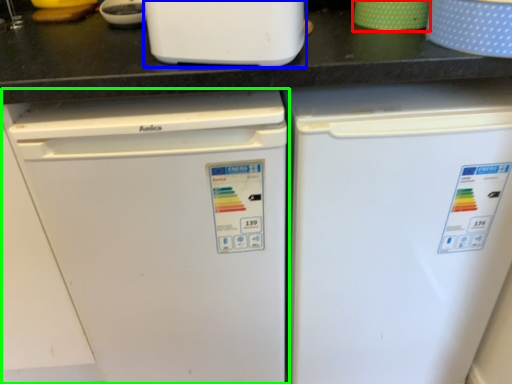
Question: Which object is positioned closest to appliance (highlighted by a red box)? Select from home appliance (highlighted by a blue box) and refrigerator (highlighted by a green box).

Choices:
 (A) home appliance
 (B) refrigerator

Answer: (A)